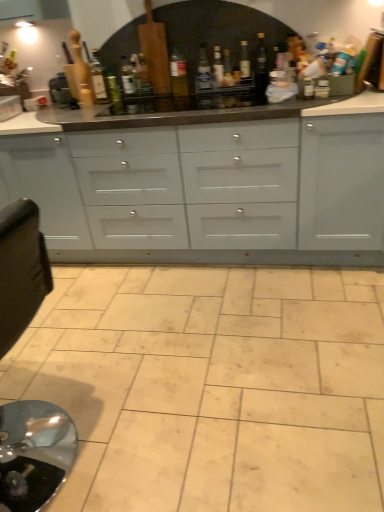
Where is `transparent glass bottle at center, which is the second bottle in right-to-left order`? This screenshot has width=384, height=512. transparent glass bottle at center, which is the second bottle in right-to-left order is located at coordinates (244, 60).

Measure the distance between wooden rolling pin at upper left, which is the tenth bottle from right to left, and camera.

wooden rolling pin at upper left, which is the tenth bottle from right to left, is 2.45 meters from camera.

This screenshot has height=512, width=384. What do you see at coordinates (98, 78) in the screenshot?
I see `translucent amber glass bottle at upper center, the 9th bottle from the right` at bounding box center [98, 78].

Identify the location of transparent glass bottle at center, the 9th bottle in the left-to-right sequence. (244, 60).

From the image's perspective, between translucent glass bottle at center, the 6th bottle positioned from the left, and beige ceramic tile at lower center, who is located below?

beige ceramic tile at lower center is shown below in the image.

In terms of width, does translucent glass bottle at center, the 6th bottle positioned from the left, look wider or thinner when compared to beige ceramic tile at lower center?

Clearly, translucent glass bottle at center, the 6th bottle positioned from the left, has less width compared to beige ceramic tile at lower center.

Is translucent glass bottle at center, acting as the fifth bottle starting from the right, inside the boundaries of beige ceramic tile at lower center, or outside?

translucent glass bottle at center, acting as the fifth bottle starting from the right, is outside beige ceramic tile at lower center.

Who is taller, translucent glass bottle at center, the 6th bottle positioned from the left, or beige ceramic tile at lower center?

translucent glass bottle at center, the 6th bottle positioned from the left.

Between translucent glass bottle at center, the 3th bottle when ordered from right to left, and translucent glass bottle at upper center, the 4th bottle viewed from the left, which one is positioned behind?

translucent glass bottle at upper center, the 4th bottle viewed from the left, is further from the camera.

From their relative heights in the image, would you say translucent glass bottle at center, which ranks as the 8th bottle in left-to-right order, is taller or shorter than translucent glass bottle at upper center, positioned as the seventh bottle in right-to-left order?

In the image, translucent glass bottle at center, which ranks as the 8th bottle in left-to-right order, appears to be taller than translucent glass bottle at upper center, positioned as the seventh bottle in right-to-left order.

Does translucent glass bottle at center, which ranks as the 8th bottle in left-to-right order, have a lesser width compared to translucent glass bottle at upper center, positioned as the seventh bottle in right-to-left order?

No.

What's the angular difference between translucent glass bottle at center, the 3th bottle when ordered from right to left, and translucent glass bottle at upper center, the 4th bottle viewed from the left,'s facing directions?

There is a 0.0386-degree angle between the facing directions of translucent glass bottle at center, the 3th bottle when ordered from right to left, and translucent glass bottle at upper center, the 4th bottle viewed from the left.

Is translucent glass bottle at center, which is counted as the 4th bottle, starting from the right, located outside black glass bottle at center, the 10th bottle when ordered from left to right?

Yes.

Starting from the black glass bottle at center, the 10th bottle when ordered from left to right, which bottle is the 3rd one to the left? Please provide its 2D coordinates.

[(203, 70)]

Who is shorter, translucent glass bottle at center, which is counted as the 4th bottle, starting from the right, or black glass bottle at center, which appears as the 1th bottle when viewed from the right?

Standing shorter between the two is black glass bottle at center, which appears as the 1th bottle when viewed from the right.

Is there a large distance between translucent glass bottle at center, which is counted as the 4th bottle, starting from the right, and black glass bottle at center, which appears as the 1th bottle when viewed from the right?

No, there isn't a large distance between translucent glass bottle at center, which is counted as the 4th bottle, starting from the right, and black glass bottle at center, which appears as the 1th bottle when viewed from the right.

Could you tell me if translucent amber glass bottle at upper center, the 9th bottle from the right, is turned towards translucent glass bottle at center, which is the 3th bottle in left-to-right order?

No.

From the image's perspective, which is below, translucent amber glass bottle at upper center, the second bottle from the left, or translucent glass bottle at center, which is the 3th bottle in left-to-right order?

From the image's view, translucent amber glass bottle at upper center, the second bottle from the left, is below.

Which object is positioned more to the left, translucent amber glass bottle at upper center, the second bottle from the left, or translucent glass bottle at center, which is the 3th bottle in left-to-right order?

translucent amber glass bottle at upper center, the second bottle from the left.

Is point (292, 256) more distant than point (40, 423)?

Yes, it is behind point (40, 423).

Is white glossy cabinets at center located outside black leather swivel chair at left?

Absolutely, white glossy cabinets at center is external to black leather swivel chair at left.

Considering the sizes of objects white glossy cabinets at center and black leather swivel chair at left in the image provided, who is wider, white glossy cabinets at center or black leather swivel chair at left?

white glossy cabinets at center is wider.

Is translucent glass bottle at center, arranged as the fifth bottle when viewed from the left, shorter than translucent amber glass bottle at upper center, the second bottle from the left?

Correct, translucent glass bottle at center, arranged as the fifth bottle when viewed from the left, is not as tall as translucent amber glass bottle at upper center, the second bottle from the left.

From the image's perspective, which one is positioned lower, translucent glass bottle at center, arranged as the fifth bottle when viewed from the left, or translucent amber glass bottle at upper center, the second bottle from the left?

translucent amber glass bottle at upper center, the second bottle from the left, appears lower in the image.

From a real-world perspective, does translucent glass bottle at center, marked as the sixth bottle in a right-to-left arrangement, sit lower than translucent amber glass bottle at upper center, the second bottle from the left?

Yes, from a real-world perspective, translucent glass bottle at center, marked as the sixth bottle in a right-to-left arrangement, is below translucent amber glass bottle at upper center, the second bottle from the left.

Is translucent glass bottle at center, arranged as the fifth bottle when viewed from the left, in front of or behind translucent amber glass bottle at upper center, the 9th bottle from the right, in the image?

Visually, translucent glass bottle at center, arranged as the fifth bottle when viewed from the left, is located behind translucent amber glass bottle at upper center, the 9th bottle from the right.

Which object is wider, translucent glass bottle at center, which is the 3th bottle in left-to-right order, or black leather swivel chair at left?

Wider between the two is black leather swivel chair at left.

Is the depth of translucent glass bottle at center, which is the 3th bottle in left-to-right order, greater than that of black leather swivel chair at left?

Yes, it is.

Which object is positioned more to the left, translucent glass bottle at center, the eighth bottle in the right-to-left sequence, or black leather swivel chair at left?

black leather swivel chair at left is more to the left.

Find the location of a particular element. This screenshot has height=512, width=384. ceramic tile on the left of the translucent glass bottle at center, the 6th bottle positioned from the left is located at coordinates (212, 386).

This screenshot has width=384, height=512. Find the location of `the 4th bottle behind the translucent glass bottle at center, the 3th bottle when ordered from right to left`. the 4th bottle behind the translucent glass bottle at center, the 3th bottle when ordered from right to left is located at coordinates (136, 71).

Based on their spatial positions, is white glossy cabinets at center or translucent glass bottle at center, acting as the fifth bottle starting from the right, closer to black glass bottle at center, which appears as the 1th bottle when viewed from the right?

translucent glass bottle at center, acting as the fifth bottle starting from the right, is positioned closer to the anchor black glass bottle at center, which appears as the 1th bottle when viewed from the right.

From the image, which object appears to be farther from beige ceramic tile at lower center, black glass bottle at center, the 10th bottle when ordered from left to right, or white glossy cabinets at center?

black glass bottle at center, the 10th bottle when ordered from left to right.

Considering their positions, is beige ceramic tile at lower center positioned closer to wooden rolling pin at upper left, which is counted as the 1th bottle, starting from the left, than translucent glass bottle at center, the 3th bottle when ordered from right to left?

Based on the image, translucent glass bottle at center, the 3th bottle when ordered from right to left, appears to be nearer to wooden rolling pin at upper left, which is counted as the 1th bottle, starting from the left.

Based on their spatial positions, is black leather swivel chair at left or white glossy cabinets at center closer to translucent glass bottle at center, acting as the fifth bottle starting from the right?

→ Among the two, white glossy cabinets at center is located nearer to translucent glass bottle at center, acting as the fifth bottle starting from the right.

Looking at the image, which one is located closer to translucent glass bottle at center, the eighth bottle in the right-to-left sequence, translucent amber glass bottle at upper center, the 9th bottle from the right, or translucent glass bottle at upper center, the 4th bottle viewed from the left?

translucent glass bottle at upper center, the 4th bottle viewed from the left, is closer to translucent glass bottle at center, the eighth bottle in the right-to-left sequence.

Looking at the image, which one is located closer to translucent glass bottle at center, which appears as the seventh bottle when viewed from the left, translucent glass bottle at upper center, positioned as the seventh bottle in right-to-left order, or translucent glass bottle at center, the 6th bottle positioned from the left?

translucent glass bottle at center, the 6th bottle positioned from the left, is positioned closer to the anchor translucent glass bottle at center, which appears as the seventh bottle when viewed from the left.

Looking at the image, which one is located further to translucent glass bottle at center, which is the 3th bottle in left-to-right order, white glossy cabinets at center or translucent glass bottle at center, acting as the fifth bottle starting from the right?

The object further to translucent glass bottle at center, which is the 3th bottle in left-to-right order, is white glossy cabinets at center.

Estimate the real-world distances between objects in this image. Which object is closer to transparent glass bottle at center, which is the second bottle in right-to-left order, white glossy cabinets at center or black leather swivel chair at left?

Based on the image, white glossy cabinets at center appears to be nearer to transparent glass bottle at center, which is the second bottle in right-to-left order.

Where is `swivel chair between translucent glass bottle at center, which appears as the seventh bottle when viewed from the left, and beige ceramic tile at lower center in the up-down direction`? Image resolution: width=384 pixels, height=512 pixels. swivel chair between translucent glass bottle at center, which appears as the seventh bottle when viewed from the left, and beige ceramic tile at lower center in the up-down direction is located at coordinates 34,454.

Find the location of a particular element. This screenshot has width=384, height=512. cabinetry between black leather swivel chair at left and translucent glass bottle at center, the eighth bottle in the right-to-left sequence, in the front-back direction is located at coordinates (206, 188).

Identify the location of ceramic tile between black leather swivel chair at left and translucent glass bottle at upper center, the 4th bottle viewed from the left, from front to back. This screenshot has width=384, height=512. (212, 386).

Find the location of a particular element. cabinetry between black leather swivel chair at left and black glass bottle at center, the 10th bottle when ordered from left to right, from front to back is located at coordinates (206, 188).